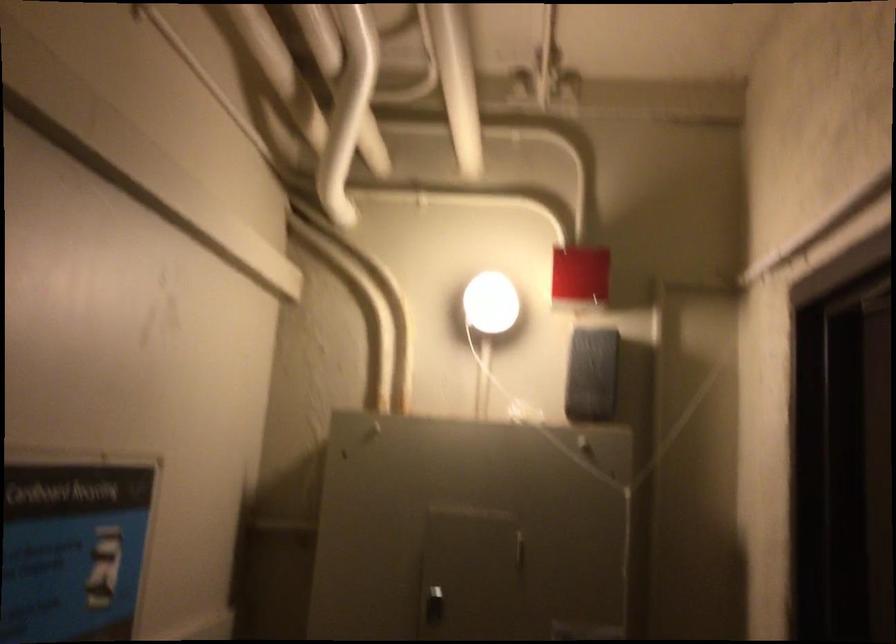
This screenshot has height=644, width=896. What do you see at coordinates (504, 389) in the screenshot? I see `the light pull cord` at bounding box center [504, 389].